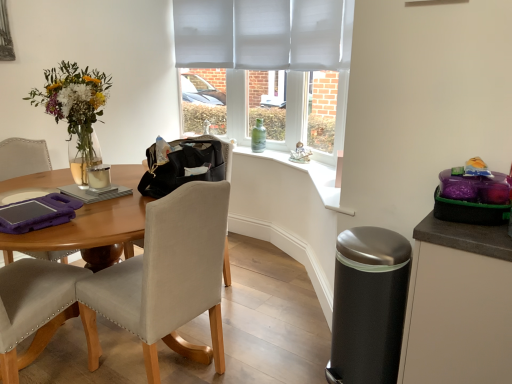
The height and width of the screenshot is (384, 512). Find the location of `vacant space underneath beige fabric chair at left (from a real-world perspective)`. vacant space underneath beige fabric chair at left (from a real-world perspective) is located at coordinates (166, 369).